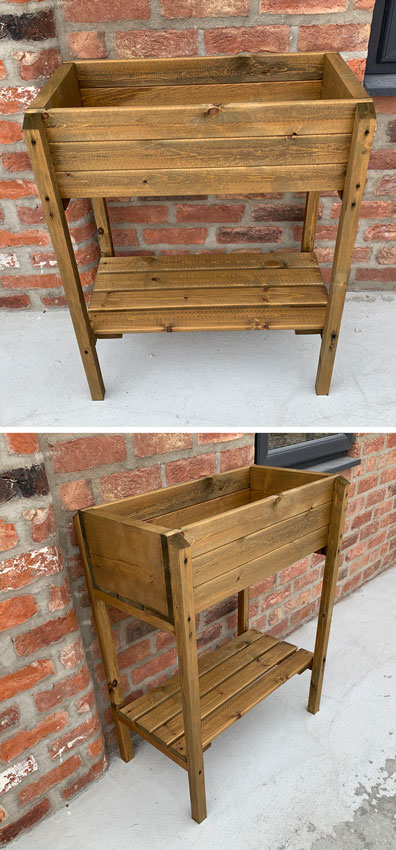
At what (x,y) coordinates should I click in order to perform the action: click on planter box. Please return your answer as a coordinate pair (x, y). Looking at the image, I should click on (220, 547).